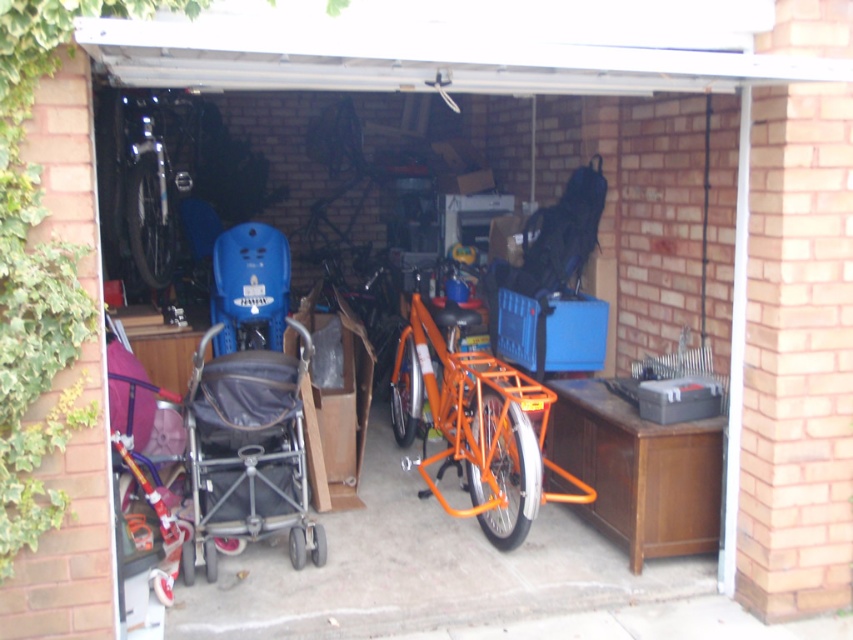
Question: Does silver metallic stroller at center-left have a smaller size compared to shiny metallic bicycle at left?

Choices:
 (A) yes
 (B) no

Answer: (A)

Question: Which object appears closest to the camera in this image?

Choices:
 (A) shiny metallic bicycle at left
 (B) silver metallic stroller at center-left

Answer: (B)

Question: Is silver metallic stroller at center-left bigger than shiny metallic bicycle at left?

Choices:
 (A) no
 (B) yes

Answer: (A)

Question: Among these objects, which one is nearest to the camera?

Choices:
 (A) silver metallic stroller at center-left
 (B) shiny metallic bicycle at left

Answer: (A)

Question: Is silver metallic stroller at center-left to the left of shiny metallic bicycle at left from the viewer's perspective?

Choices:
 (A) no
 (B) yes

Answer: (A)